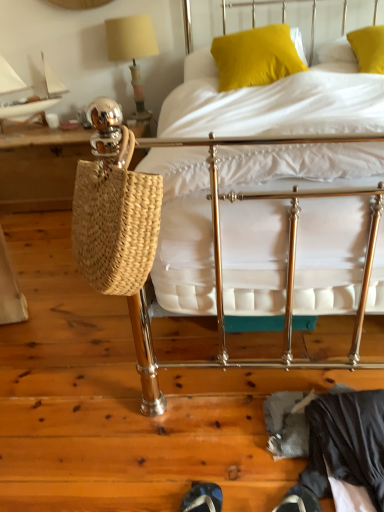
Image resolution: width=384 pixels, height=512 pixels. I want to click on matte yellow fabric lampshade at upper left, so click(132, 50).

Image resolution: width=384 pixels, height=512 pixels. What are the coordinates of `yellow fabric pillow at upper right, which is counted as the first pillow, starting from the right` in the screenshot? It's located at (368, 48).

The height and width of the screenshot is (512, 384). What do you see at coordinates (273, 104) in the screenshot? I see `metallic gold bed at center` at bounding box center [273, 104].

Locate an element on the screen. This screenshot has height=512, width=384. woven straw bag at left is located at coordinates (40, 168).

The width and height of the screenshot is (384, 512). What do you see at coordinates (255, 57) in the screenshot?
I see `yellow fabric pillow at upper center, positioned as the 1th pillow in left-to-right order` at bounding box center [255, 57].

The height and width of the screenshot is (512, 384). I want to click on matte yellow fabric lampshade at upper left, so click(132, 50).

Are shiny black shoe at lower center and dark gray fabric at lower right far apart?

No.

From a real-world perspective, does shiny black shoe at lower center sit lower than dark gray fabric at lower right?

Yes, from a real-world perspective, shiny black shoe at lower center is below dark gray fabric at lower right.

Between shiny black shoe at lower center and dark gray fabric at lower right, which one has smaller size?

With smaller size is shiny black shoe at lower center.

From the image's perspective, which one is positioned higher, shiny black shoe at lower center or dark gray fabric at lower right?

dark gray fabric at lower right.

Relative to dark gray fabric at lower right, is woven straw bag at left in front or behind?

woven straw bag at left is positioned farther from the viewer than dark gray fabric at lower right.

Is woven straw bag at left facing away from dark gray fabric at lower right?

woven straw bag at left is not turned away from dark gray fabric at lower right.

From the image's perspective, is woven straw bag at left over dark gray fabric at lower right?

Correct, woven straw bag at left appears higher than dark gray fabric at lower right in the image.

Which of these two, woven straw bag at left or dark gray fabric at lower right, stands shorter?

dark gray fabric at lower right.

How many degrees apart are the facing directions of metallic gold bed at center and shiny black shoe at lower center?

85.7 degrees separate the facing orientations of metallic gold bed at center and shiny black shoe at lower center.

Between metallic gold bed at center and shiny black shoe at lower center, which one has smaller size?

shiny black shoe at lower center is smaller.

From the image's perspective, does metallic gold bed at center appear lower than shiny black shoe at lower center?

Incorrect, from the image's perspective, metallic gold bed at center is higher than shiny black shoe at lower center.

In the scene shown: Is metallic gold bed at center wider than shiny black shoe at lower center?

Yes, metallic gold bed at center is wider than shiny black shoe at lower center.

Which of these two, matte yellow fabric lampshade at upper left or woven straw bag at left, is wider?

Wider between the two is woven straw bag at left.

Which is in front, point (134, 30) or point (13, 146)?

Positioned in front is point (134, 30).

Based on the photo, from a real-world perspective, which object stands above the other?

In real-world perspective, matte yellow fabric lampshade at upper left is above.

Considering the sizes of dark gray fabric at lower right and matte yellow fabric lampshade at upper left in the image, is dark gray fabric at lower right bigger or smaller than matte yellow fabric lampshade at upper left?

In the image, dark gray fabric at lower right appears to be smaller than matte yellow fabric lampshade at upper left.

Is dark gray fabric at lower right facing away from matte yellow fabric lampshade at upper left?

dark gray fabric at lower right is not turned away from matte yellow fabric lampshade at upper left.

From a real-world perspective, is dark gray fabric at lower right positioned over matte yellow fabric lampshade at upper left based on gravity?

No.

Which object is wider, dark gray fabric at lower right or matte yellow fabric lampshade at upper left?

Wider between the two is dark gray fabric at lower right.

Locate an element on the screen. The height and width of the screenshot is (512, 384). table above the dark gray fabric at lower right (from a real-world perspective) is located at coordinates (40, 168).

From the image's perspective, is dark gray fabric at lower right on top of woven straw bag at left?

Actually, dark gray fabric at lower right appears below woven straw bag at left in the image.

Is point (340, 431) closer or farther from the camera than point (12, 135)?

Clearly, point (340, 431) is closer to the camera than point (12, 135).

Who is shorter, dark gray fabric at lower right or woven straw bag at left?

Standing shorter between the two is dark gray fabric at lower right.

Locate an element on the screen. The height and width of the screenshot is (512, 384). shoe behind the metallic gold bed at center is located at coordinates tap(203, 498).

Is shiny black shoe at lower center located outside metallic gold bed at center?

Yes, shiny black shoe at lower center is located beyond the bounds of metallic gold bed at center.

Is shiny black shoe at lower center positioned with its back to metallic gold bed at center?

No, shiny black shoe at lower center is not facing away from metallic gold bed at center.

The width and height of the screenshot is (384, 512). What are the coordinates of `clothing located behind the shiny black shoe at lower center` in the screenshot? It's located at (346, 443).

Identify the location of clothing on the right side of woven straw bag at left. This screenshot has width=384, height=512. (346, 443).

When comparing their distances from shiny black shoe at lower center, does metallic gold bed at center or yellow fabric pillow at upper center, positioned as the 1th pillow in left-to-right order, seem closer?

metallic gold bed at center.

When comparing their distances from yellow fabric pillow at upper center, positioned as the 1th pillow in left-to-right order, does metallic gold bed at center or dark gray fabric at lower right seem closer?

metallic gold bed at center is positioned closer to the anchor yellow fabric pillow at upper center, positioned as the 1th pillow in left-to-right order.

Which object lies nearer to the anchor point metallic gold bed at center, yellow fabric pillow at upper right, which is counted as the first pillow, starting from the right, or yellow fabric pillow at upper center, the 2th pillow in the right-to-left sequence?

The object closer to metallic gold bed at center is yellow fabric pillow at upper center, the 2th pillow in the right-to-left sequence.

Based on the photo, looking at the image, which one is located further to metallic gold bed at center, matte yellow fabric lampshade at upper left or dark gray fabric at lower right?

matte yellow fabric lampshade at upper left.

Estimate the real-world distances between objects in this image. Which object is further from dark gray fabric at lower right, shiny black shoe at lower center or metallic gold bed at center?

metallic gold bed at center is further to dark gray fabric at lower right.

Consider the image. When comparing their distances from shiny black shoe at lower center, does dark gray fabric at lower right or yellow fabric pillow at upper right, which is counted as the first pillow, starting from the right, seem further?

Among the two, yellow fabric pillow at upper right, which is counted as the first pillow, starting from the right, is located further to shiny black shoe at lower center.

From the image, which object appears to be nearer to matte yellow fabric lampshade at upper left, dark gray fabric at lower right or shiny black shoe at lower center?

Based on the image, dark gray fabric at lower right appears to be nearer to matte yellow fabric lampshade at upper left.

From the image, which object appears to be farther from shiny black shoe at lower center, metallic gold bed at center or matte yellow fabric lampshade at upper left?

matte yellow fabric lampshade at upper left.

Locate an element on the screen. clothing between metallic gold bed at center and shiny black shoe at lower center in the vertical direction is located at coordinates (346, 443).

The image size is (384, 512). I want to click on clothing between matte yellow fabric lampshade at upper left and shiny black shoe at lower center from top to bottom, so click(x=346, y=443).

Where is `bed between yellow fabric pillow at upper center, positioned as the 1th pillow in left-to-right order, and dark gray fabric at lower right from top to bottom`? This screenshot has width=384, height=512. bed between yellow fabric pillow at upper center, positioned as the 1th pillow in left-to-right order, and dark gray fabric at lower right from top to bottom is located at coordinates (273, 104).

Locate an element on the screen. The height and width of the screenshot is (512, 384). bed between yellow fabric pillow at upper center, positioned as the 1th pillow in left-to-right order, and shiny black shoe at lower center from top to bottom is located at coordinates (273, 104).